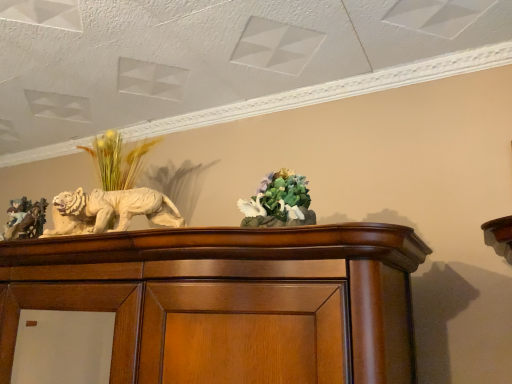
Question: Is white glossy sculpture at left wider than green matte floral arrangement at center?

Choices:
 (A) no
 (B) yes

Answer: (B)

Question: Can green matte floral arrangement at center be found inside white glossy sculpture at left?

Choices:
 (A) yes
 (B) no

Answer: (B)

Question: From the image's perspective, is white glossy sculpture at left above green matte floral arrangement at center?

Choices:
 (A) yes
 (B) no

Answer: (B)

Question: Is white glossy sculpture at left positioned before green matte floral arrangement at center?

Choices:
 (A) no
 (B) yes

Answer: (A)

Question: Does white glossy sculpture at left appear on the left side of green matte floral arrangement at center?

Choices:
 (A) no
 (B) yes

Answer: (B)

Question: From a real-world perspective, is green matte floral arrangement at center above or below matte brown figurine at left?

Choices:
 (A) below
 (B) above

Answer: (A)

Question: Does point (279, 215) appear closer or farther from the camera than point (28, 203)?

Choices:
 (A) closer
 (B) farther

Answer: (A)

Question: Considering the positions of green matte floral arrangement at center and matte brown figurine at left in the image, is green matte floral arrangement at center taller or shorter than matte brown figurine at left?

Choices:
 (A) tall
 (B) short

Answer: (B)

Question: From the image's perspective, is green matte floral arrangement at center located above or below matte brown figurine at left?

Choices:
 (A) above
 (B) below

Answer: (A)

Question: In terms of height, does white glossy sculpture at left look taller or shorter compared to matte brown figurine at left?

Choices:
 (A) short
 (B) tall

Answer: (A)

Question: In the image, is white glossy sculpture at left on the left side or the right side of matte brown figurine at left?

Choices:
 (A) right
 (B) left

Answer: (A)

Question: Is white glossy sculpture at left inside or outside of matte brown figurine at left?

Choices:
 (A) inside
 (B) outside

Answer: (B)

Question: From the image's perspective, is white glossy sculpture at left positioned above or below matte brown figurine at left?

Choices:
 (A) below
 (B) above

Answer: (B)

Question: Would you say matte brown figurine at left is to the left or to the right of white glossy sculpture at left in the picture?

Choices:
 (A) left
 (B) right

Answer: (A)

Question: Is point (40, 205) positioned closer to the camera than point (68, 228)?

Choices:
 (A) closer
 (B) farther

Answer: (B)